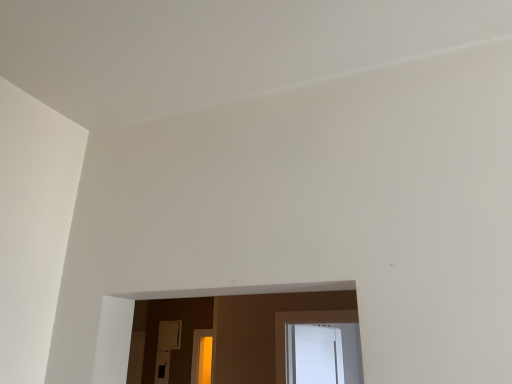
Describe the element at coordinates (166, 348) in the screenshot. Image resolution: width=512 pixels, height=384 pixels. I see `white glossy door at center` at that location.

I want to click on white glossy door at center, so click(166, 348).

What are the coordinates of `white glossy door at center` in the screenshot? It's located at (166, 348).